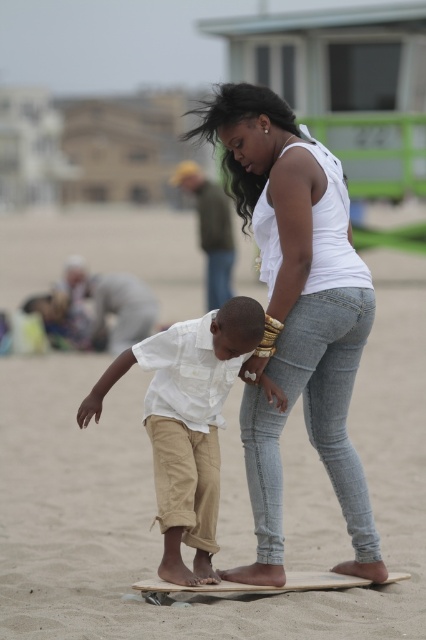
Question: Among these points, which one is farthest from the camera?

Choices:
 (A) (294, 580)
 (B) (241, 353)
 (C) (89, 442)

Answer: (C)

Question: Among these objects, which one is nearest to the camera?

Choices:
 (A) wooden skateboard at center
 (B) smooth wooden surfboard at center

Answer: (B)

Question: Observing the image, what is the correct spatial positioning of white denim jeans at center in reference to white cotton shirt at center?

Choices:
 (A) below
 (B) above

Answer: (B)

Question: Is white denim jeans at center further to the viewer compared to white cotton shirt at center?

Choices:
 (A) yes
 (B) no

Answer: (A)

Question: Does smooth wooden surfboard at center come in front of wooden skateboard at center?

Choices:
 (A) no
 (B) yes

Answer: (B)

Question: Which object is positioned closest to the smooth wooden surfboard at center?

Choices:
 (A) white cotton shirt at center
 (B) white denim jeans at center

Answer: (A)